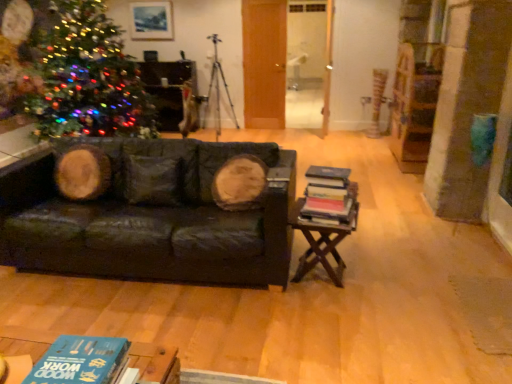
Question: Should I look upward or downward to see wooden at right?

Choices:
 (A) down
 (B) up

Answer: (A)

Question: Is hardcover books at right, the 1th book positioned from the top, turned away from blue matte book at lower left, marked as the second book in a right-to-left arrangement?

Choices:
 (A) no
 (B) yes

Answer: (A)

Question: Can you confirm if hardcover books at right, which is counted as the first book, starting from the right, is thinner than blue matte book at lower left, placed as the 1th book when sorted from left to right?

Choices:
 (A) yes
 (B) no

Answer: (A)

Question: Is blue matte book at lower left, the 2th book from the top, inside hardcover books at right, which ranks as the second book in front-to-back order?

Choices:
 (A) no
 (B) yes

Answer: (A)

Question: Can you confirm if hardcover books at right, the 1th book positioned from the top, is wider than blue matte book at lower left, marked as the second book in a right-to-left arrangement?

Choices:
 (A) yes
 (B) no

Answer: (B)

Question: Are hardcover books at right, arranged as the first book when viewed from the back, and blue matte book at lower left, placed as the 1th book when sorted from left to right, far apart?

Choices:
 (A) yes
 (B) no

Answer: (A)

Question: Can you confirm if hardcover books at right, which is counted as the first book, starting from the right, is bigger than blue matte book at lower left, placed as the 1th book when sorted from front to back?

Choices:
 (A) no
 (B) yes

Answer: (B)

Question: From the image's perspective, is matte wooden picture frame at upper center beneath multicolored lights at left?

Choices:
 (A) no
 (B) yes

Answer: (A)

Question: Is multicolored lights at left at the back of matte wooden picture frame at upper center?

Choices:
 (A) no
 (B) yes

Answer: (A)

Question: Considering the relative sizes of matte wooden picture frame at upper center and multicolored lights at left in the image provided, is matte wooden picture frame at upper center wider than multicolored lights at left?

Choices:
 (A) no
 (B) yes

Answer: (A)

Question: Is matte wooden picture frame at upper center surrounding multicolored lights at left?

Choices:
 (A) no
 (B) yes

Answer: (A)

Question: Is matte wooden picture frame at upper center closer to camera compared to multicolored lights at left?

Choices:
 (A) yes
 (B) no

Answer: (B)

Question: Considering the relative positions of matte wooden picture frame at upper center and multicolored lights at left in the image provided, is matte wooden picture frame at upper center to the right of multicolored lights at left from the viewer's perspective?

Choices:
 (A) no
 (B) yes

Answer: (B)

Question: From the image's perspective, is hardcover books at right, which is counted as the first book, starting from the right, on top of metallic tripod at center?

Choices:
 (A) yes
 (B) no

Answer: (B)